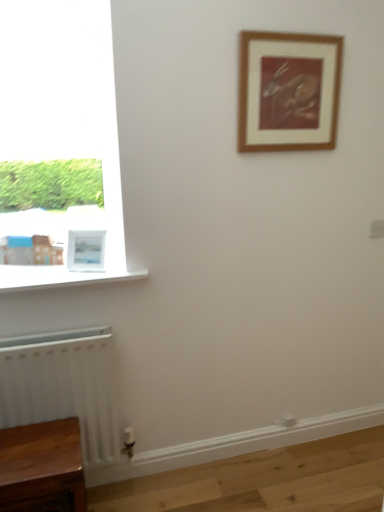
Find the location of a particular element. Image resolution: width=384 pixels, height=512 pixels. vacant area that lies in front of white matte picture frame at lower left, which is the second picture frame from right to left is located at coordinates (85, 276).